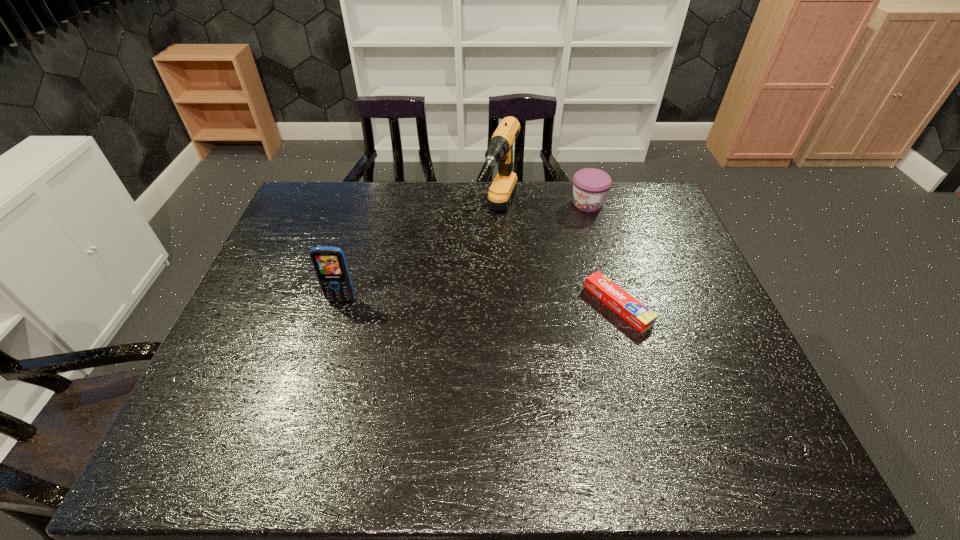
The height and width of the screenshot is (540, 960). What are the coordinates of `blank region between the third object from right to left and the shortest object` in the screenshot? It's located at (559, 259).

Where is `the third closest object to the second object from left to right`? This screenshot has height=540, width=960. the third closest object to the second object from left to right is located at coordinates coord(330,265).

This screenshot has width=960, height=540. What are the coordinates of `the second closest object relative to the shortest object` in the screenshot? It's located at (590, 186).

I want to click on vacant point that satisfies the following two spatial constraints: 1. on the screen of the shortest object; 2. on the right side of the third shortest object, so click(340, 305).

Where is `free location that satisfies the following two spatial constraints: 1. on the front side of the shortest object; 2. on the right side of the second shortest object`? Image resolution: width=960 pixels, height=540 pixels. free location that satisfies the following two spatial constraints: 1. on the front side of the shortest object; 2. on the right side of the second shortest object is located at coordinates (617, 305).

This screenshot has width=960, height=540. Find the location of `free space that satisfies the following two spatial constraints: 1. on the screen of the shortest object; 2. on the right side of the second tallest object`. free space that satisfies the following two spatial constraints: 1. on the screen of the shortest object; 2. on the right side of the second tallest object is located at coordinates (340, 305).

At what (x,y) coordinates should I click in order to perform the action: click on vacant space that satisfies the following two spatial constraints: 1. on the screen of the shortest object; 2. on the right side of the second tallest object. Please return your answer as a coordinate pair (x, y). The height and width of the screenshot is (540, 960). Looking at the image, I should click on (340, 305).